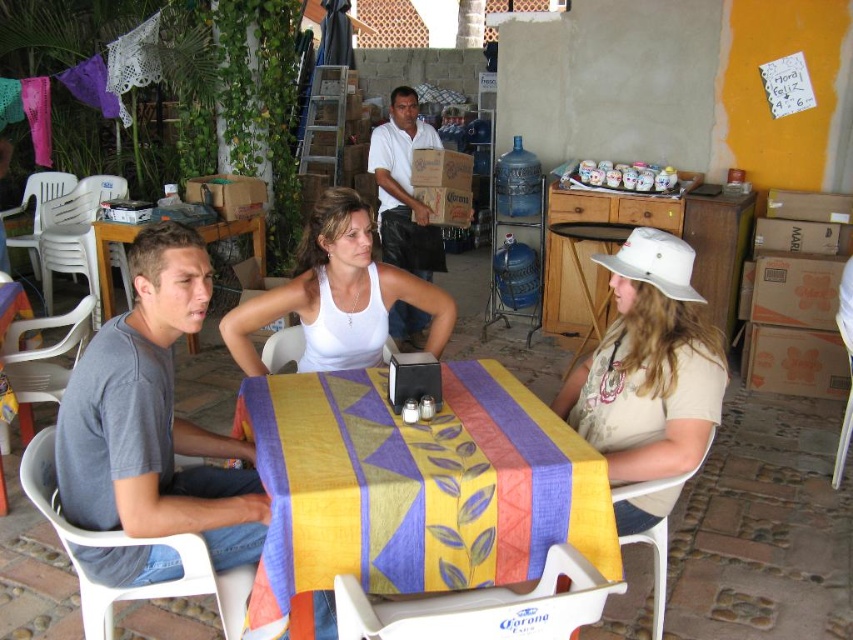
Question: Observing the image, what is the correct spatial positioning of yellow fabric tablecloth at center in reference to yellow fabric table at center?

Choices:
 (A) above
 (B) below

Answer: (B)

Question: Is beige cotton hat at center above yellow fabric table at center?

Choices:
 (A) no
 (B) yes

Answer: (A)

Question: Can you confirm if beige cotton hat at center is thinner than white matte tank top at center?

Choices:
 (A) yes
 (B) no

Answer: (A)

Question: Which point is farther to the camera?

Choices:
 (A) (653, 248)
 (B) (108, 228)
 (C) (55, 451)
 (D) (317, 250)

Answer: (B)

Question: Which point appears farthest from the camera in this image?

Choices:
 (A) (656, 465)
 (B) (350, 333)

Answer: (B)

Question: Which object is positioned closest to the white cotton shirt at center?

Choices:
 (A) white matte tank top at center
 (B) yellow fabric table at center
 (C) beige cotton hat at center
 (D) yellow fabric tablecloth at center

Answer: (B)